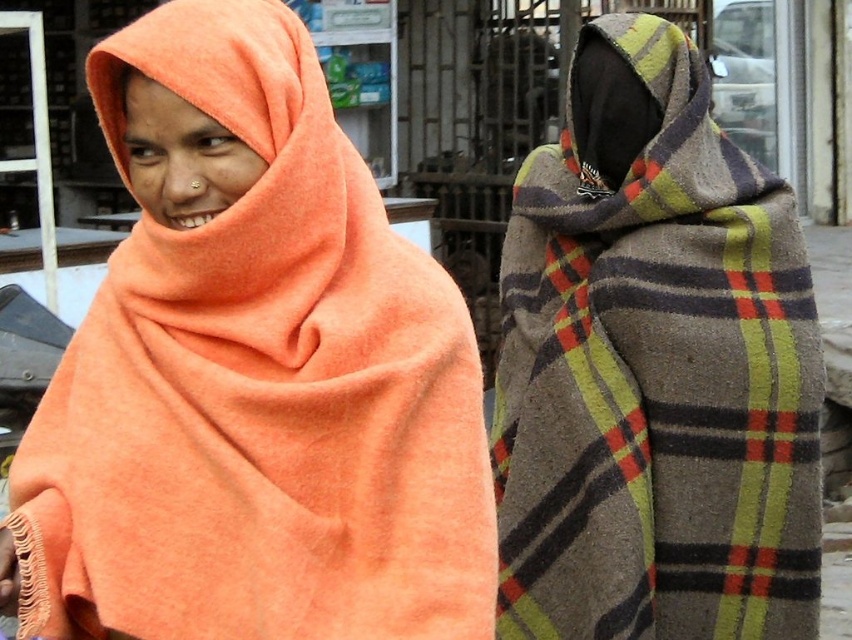
Does matte orange shawl at left have a larger size compared to plaid woolen scarf at right?

No.

Is matte orange shawl at left thinner than plaid woolen scarf at right?

Incorrect, matte orange shawl at left's width is not less than plaid woolen scarf at right's.

Identify the location of matte orange shawl at left. The image size is (852, 640). (251, 376).